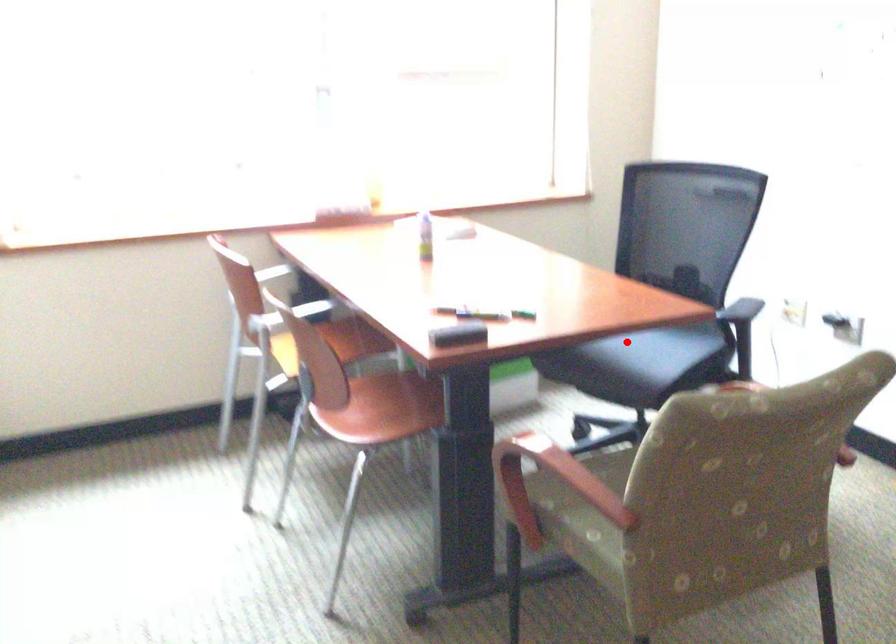
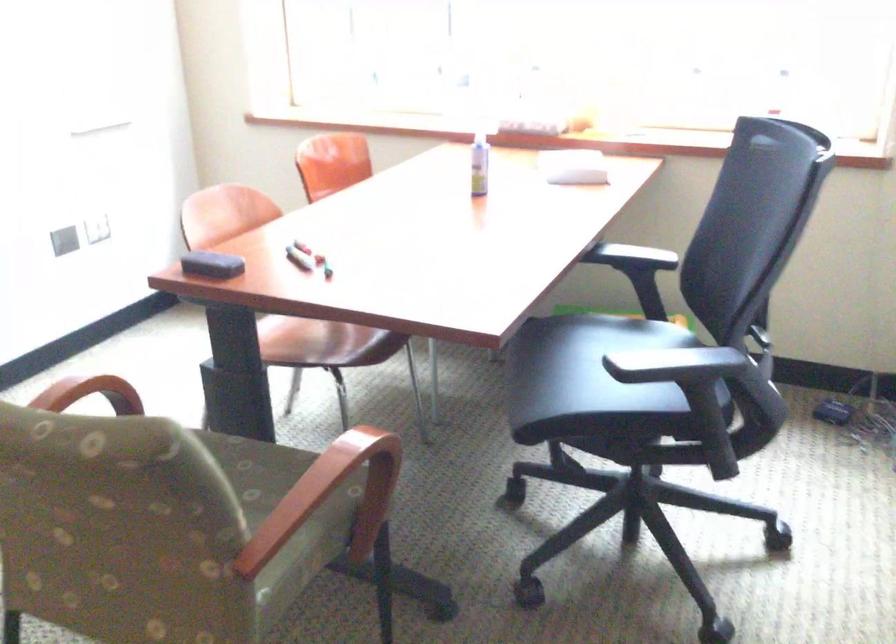
Question: I am providing you with two images of the same scene from different viewpoints. Given a red point in image1, look at the same physical point in image2. Is it:

Choices:
 (A) Closer to the viewpoint
 (B) Farther from the viewpoint

Answer: (A)